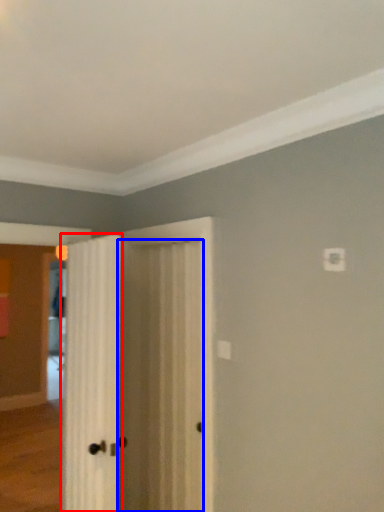
Question: Which object appears farthest to the camera in this image, door (highlighted by a red box) or door (highlighted by a blue box)?

Choices:
 (A) door
 (B) door

Answer: (B)